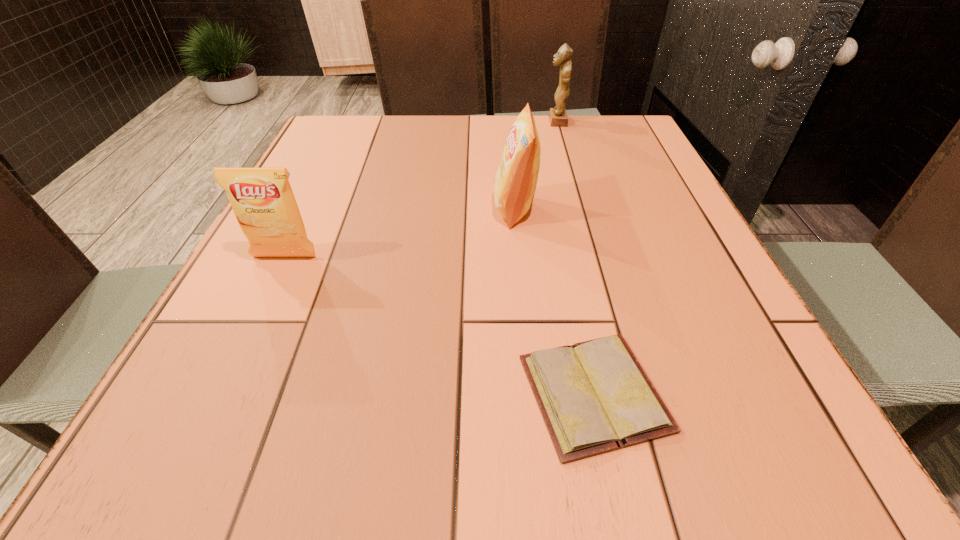
Find the location of a particular element. The width and height of the screenshot is (960, 540). vacant space located 0.100m on the front-facing side of the farther crisp (potato chip) is located at coordinates (449, 209).

The image size is (960, 540). Identify the location of free space located 0.120m on the front-facing side of the farther crisp (potato chip). (441, 209).

Locate an element on the screen. This screenshot has width=960, height=540. vacant space situated on the front-facing side of the farther crisp (potato chip) is located at coordinates (321, 209).

Locate an element on the screen. free region located on the front of the leftmost object with the logo is located at coordinates (249, 333).

Find the location of a particular element. Image resolution: width=960 pixels, height=540 pixels. vacant space located 0.320m on the left of the nearest object is located at coordinates (306, 393).

The height and width of the screenshot is (540, 960). What are the coordinates of `object at the far edge` in the screenshot? It's located at (558, 117).

Identify the location of object located in the near edge section of the desktop. Image resolution: width=960 pixels, height=540 pixels. (594, 396).

In order to click on object at the left edge in this screenshot , I will do `click(262, 199)`.

This screenshot has width=960, height=540. Identify the location of vacant space at the far edge of the desktop. (516, 121).

In the image, there is a desktop. At what (x,y) coordinates should I click in order to perform the action: click on blank space at the near edge. Please return your answer as a coordinate pair (x, y). Image resolution: width=960 pixels, height=540 pixels. Looking at the image, I should click on (560, 481).